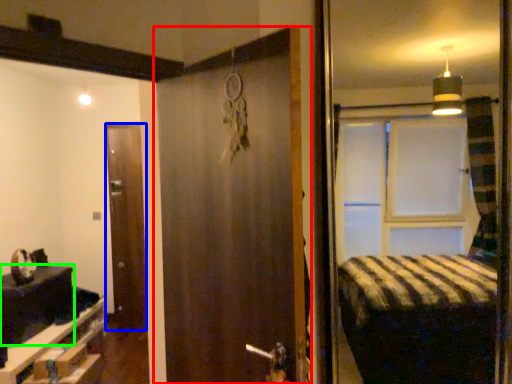
Question: Which object is the closest to the door (highlighted by a red box)? Choose among these: door (highlighted by a blue box) or table (highlighted by a green box).

Choices:
 (A) door
 (B) table

Answer: (B)